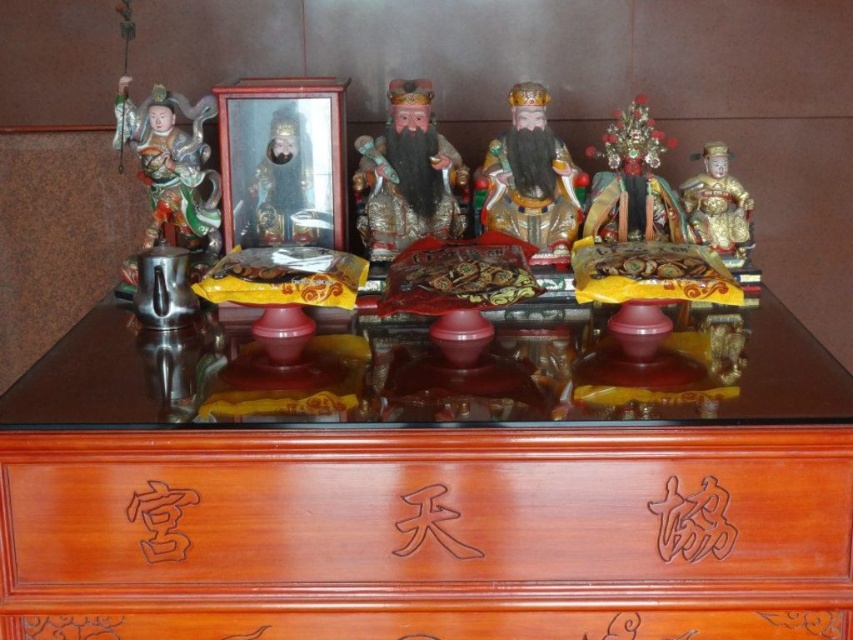
Question: Among these objects, which one is farthest from the camera?

Choices:
 (A) matte black statue at center
 (B) shiny metallic figure at left

Answer: (B)

Question: Is gold glossy statue at center below glossy gold statue at center?

Choices:
 (A) yes
 (B) no

Answer: (B)

Question: Where is wooden table at center located in relation to metallic frame at center in the image?

Choices:
 (A) above
 (B) below

Answer: (B)

Question: Considering the real-world distances, which object is farthest from the glossy gold statue at center?

Choices:
 (A) matte black statue at center
 (B) shiny metallic figure at left

Answer: (B)

Question: Is wooden table at center further to the viewer compared to shiny gold ornament at center?

Choices:
 (A) no
 (B) yes

Answer: (A)

Question: Considering the real-world distances, which object is closest to the wooden table at center?

Choices:
 (A) metallic frame at center
 (B) gold glossy statue at center
 (C) shiny gold ornament at center
 (D) gold lacquered statue at right

Answer: (B)